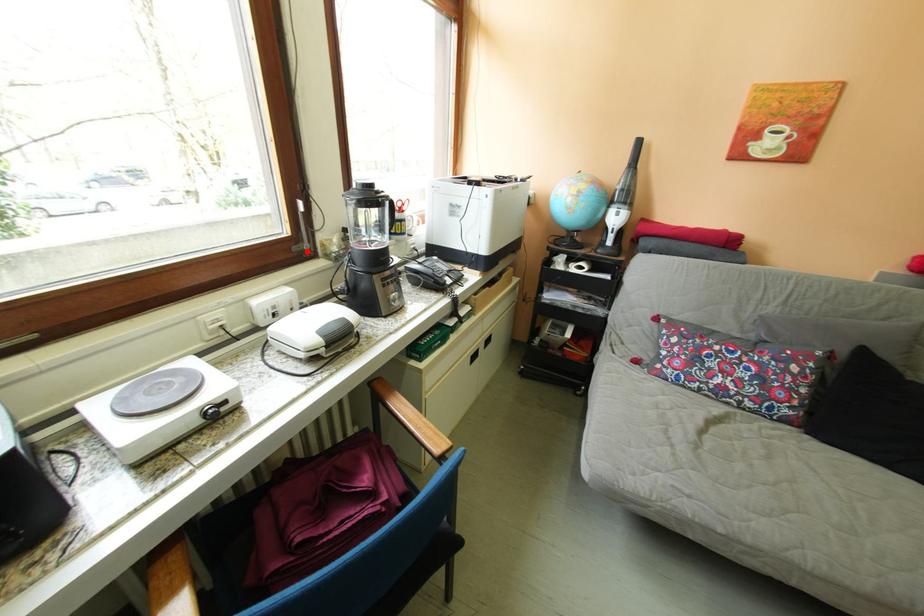
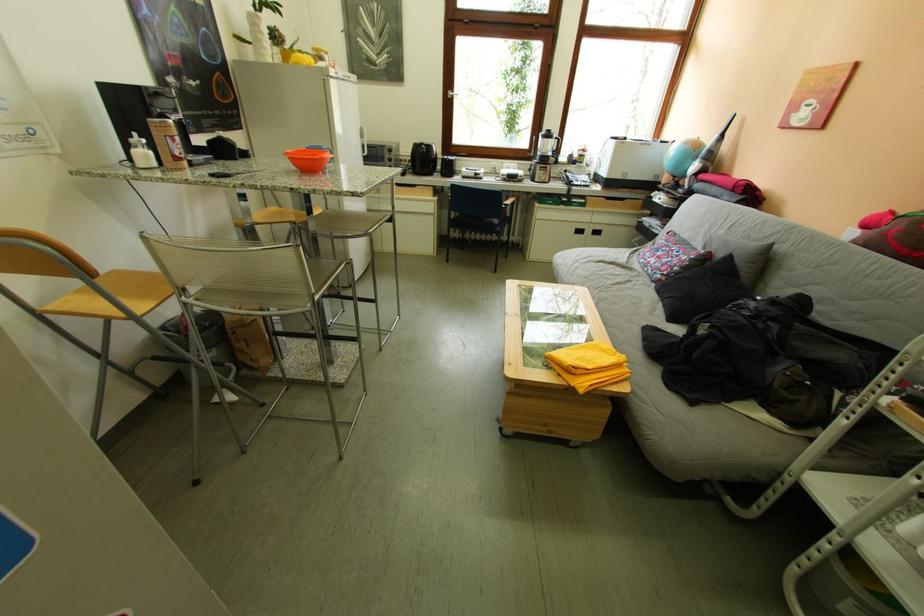
Question: I am providing you with two images of the same scene from different viewpoints. A red point is marked on the first image. At the location where the point appears in image 1, is it still visible in image 2?

Choices:
 (A) Yes
 (B) No

Answer: (A)